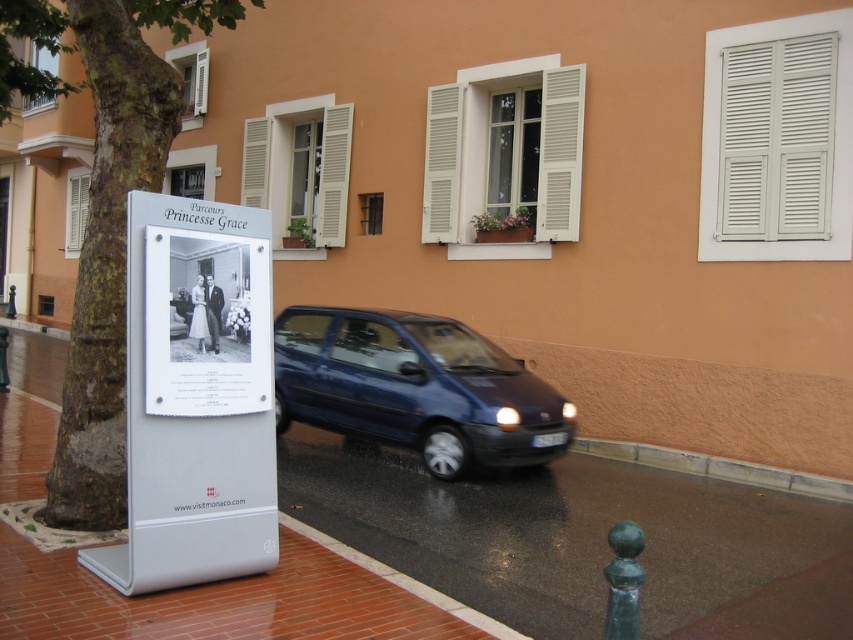
This screenshot has height=640, width=853. What do you see at coordinates (776, 140) in the screenshot?
I see `white wooden shutters at upper right` at bounding box center [776, 140].

Who is more distant from viewer, (741, 156) or (437, 109)?

The point (437, 109) is more distant.

Who is more forward, (781,90) or (434,138)?

Point (781,90) is in front.

This screenshot has width=853, height=640. Identify the location of white wooden shutters at upper right. (776, 140).

Does brown rough tree at left have a greater width compared to white wooden shutters at upper right?

Yes, brown rough tree at left is wider than white wooden shutters at upper right.

Is brown rough tree at left smaller than white wooden shutters at upper right?

Actually, brown rough tree at left might be larger than white wooden shutters at upper right.

Locate an element on the screen. brown rough tree at left is located at coordinates (103, 212).

Where is `brown rough tree at left`? brown rough tree at left is located at coordinates (103, 212).

Is white wooden shutters at upper right smaller than gray concrete curb at lower right?

Incorrect, white wooden shutters at upper right is not smaller in size than gray concrete curb at lower right.

Which is below, white wooden shutters at upper right or gray concrete curb at lower right?

gray concrete curb at lower right is lower down.

Where is `white wooden shutters at upper right`? The width and height of the screenshot is (853, 640). white wooden shutters at upper right is located at coordinates (776, 140).